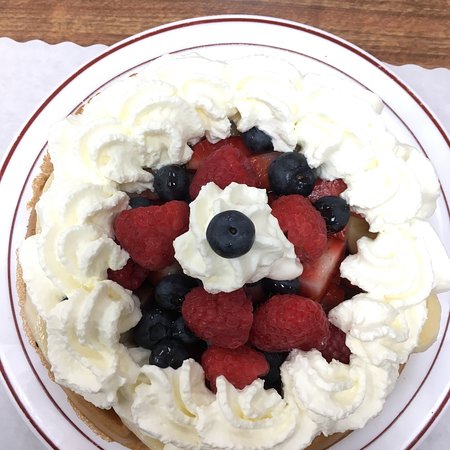
At what (x,y) coordinates should I click in order to perform the action: click on table. Please return your answer as a coordinate pair (x, y). The height and width of the screenshot is (450, 450). Looking at the image, I should click on [x=394, y=32].